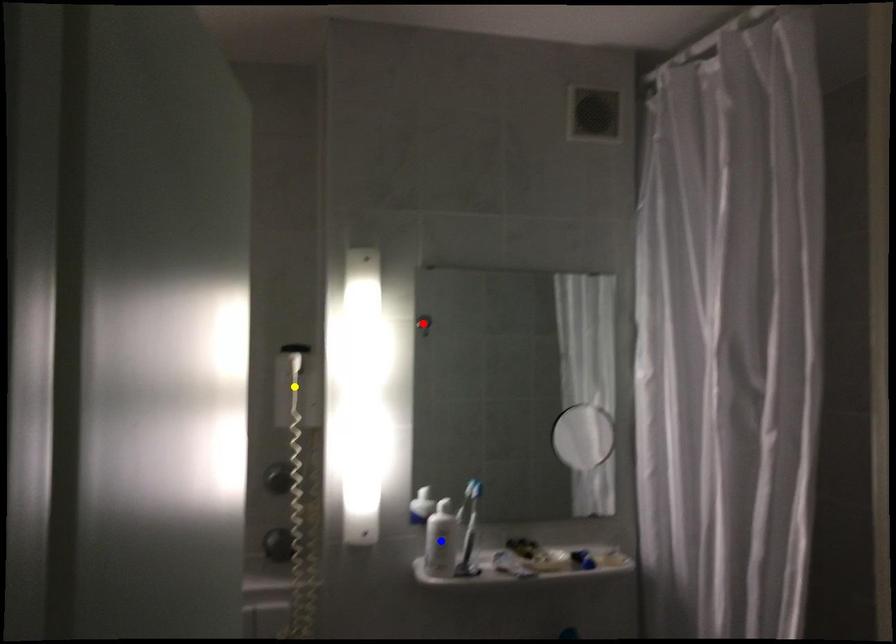
Order these from nearest to farthest:
A) blue point
B) red point
C) yellow point

1. red point
2. yellow point
3. blue point